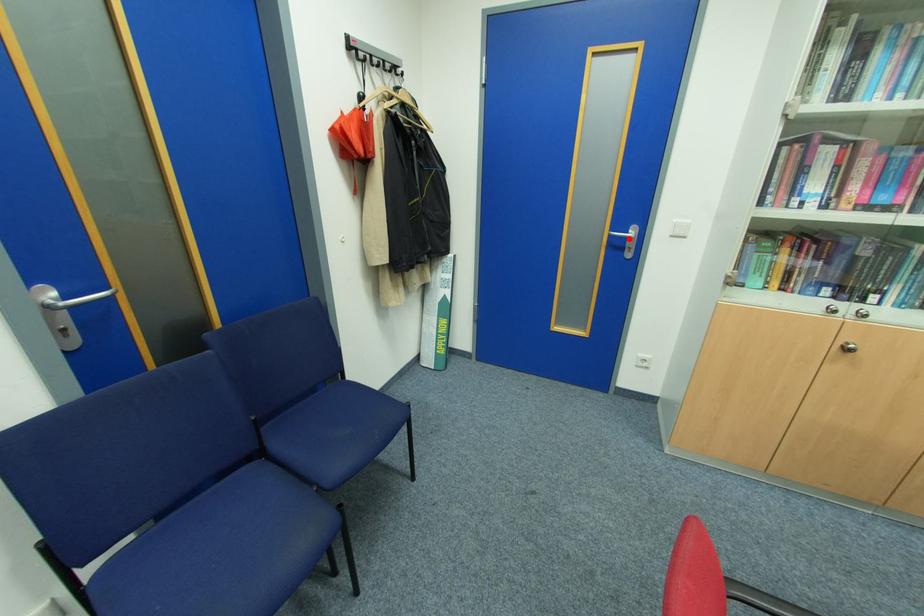
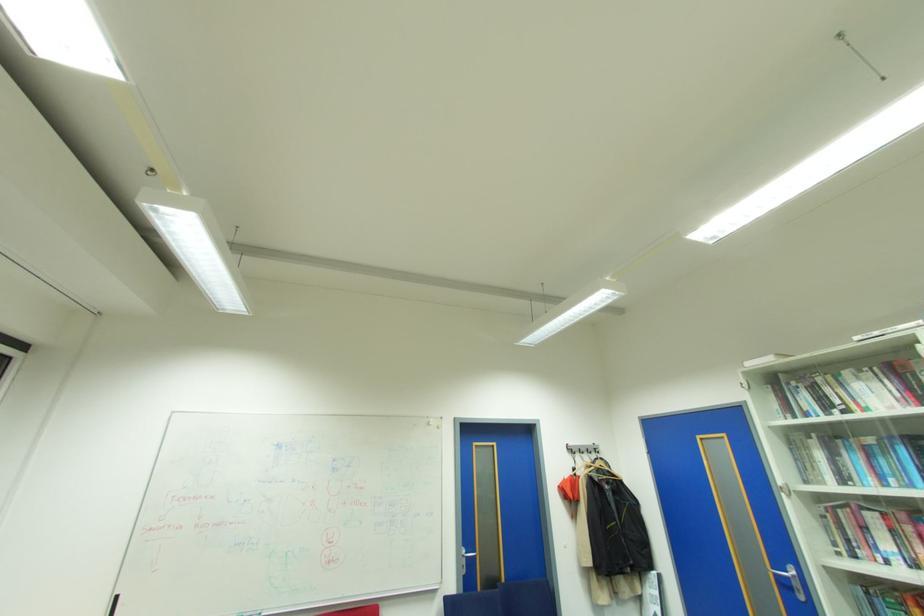
The point at the highlighted location is marked in the first image. Where is the corresponding point in the second image?

(791, 578)